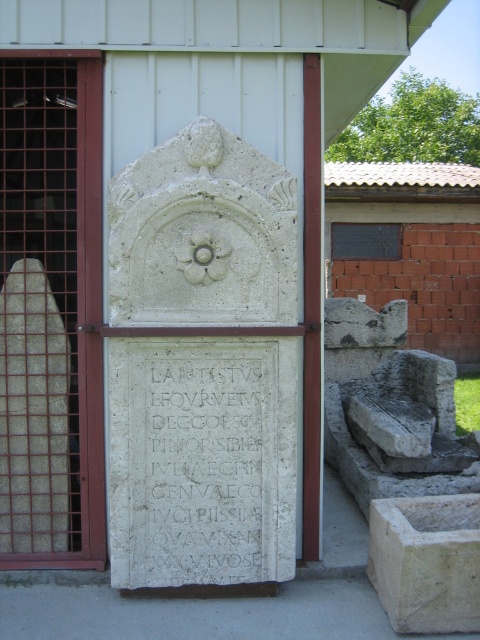
You are standing in front of the monument and want to locate the white stone plaque at center. Where should you look relative to the monument?

The white stone plaque at center is located at the central position of the monument, so you should look straight ahead towards the middle of the monument to find it.

You are an archaeologist examining the monument and need to determine which of the two points, point 1 at coordinates [152,509] or point 2 at coordinates [192,387], is closer to you. Which point is nearer?

Point 1 at coordinates [152,509] is closer to you than point 2 at coordinates [192,387] because it is further to the viewer.

You are an archaeologist examining the monument. You need to determine if the white stone plaque at center can fit into a transport container designed to hold items up to the width of the white stone basin at lower right. Based on the available information, will the plaque fit?

The white stone plaque at center might be wider than white stone basin at lower right, so there is uncertainty about whether it will fit into the container designed for the basin.